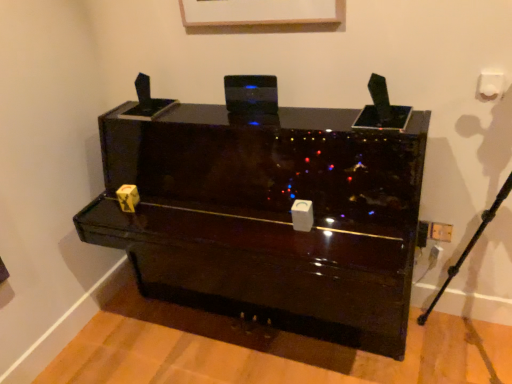
The image size is (512, 384). I want to click on free region under glossy dark wood piano at center (from a real-world perspective), so click(x=250, y=347).